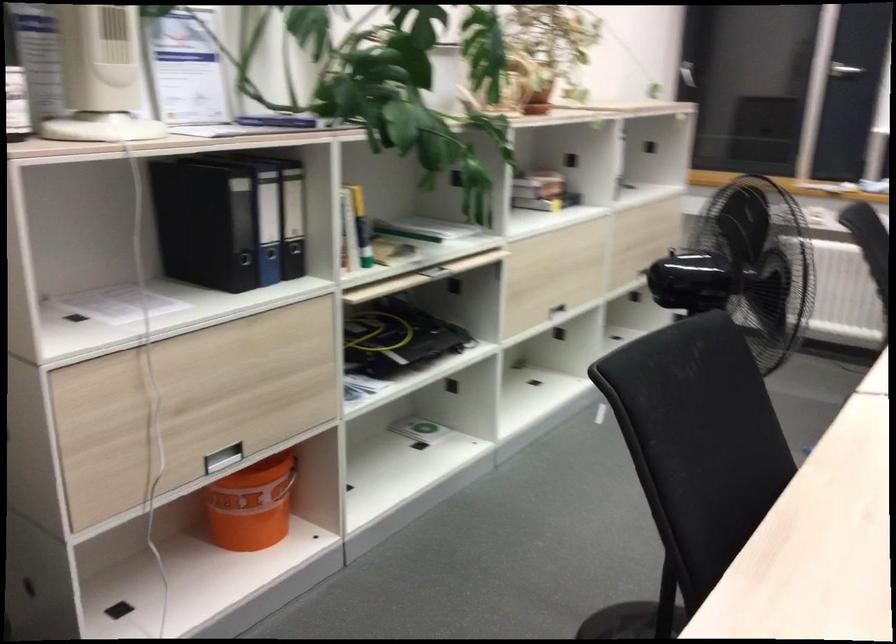
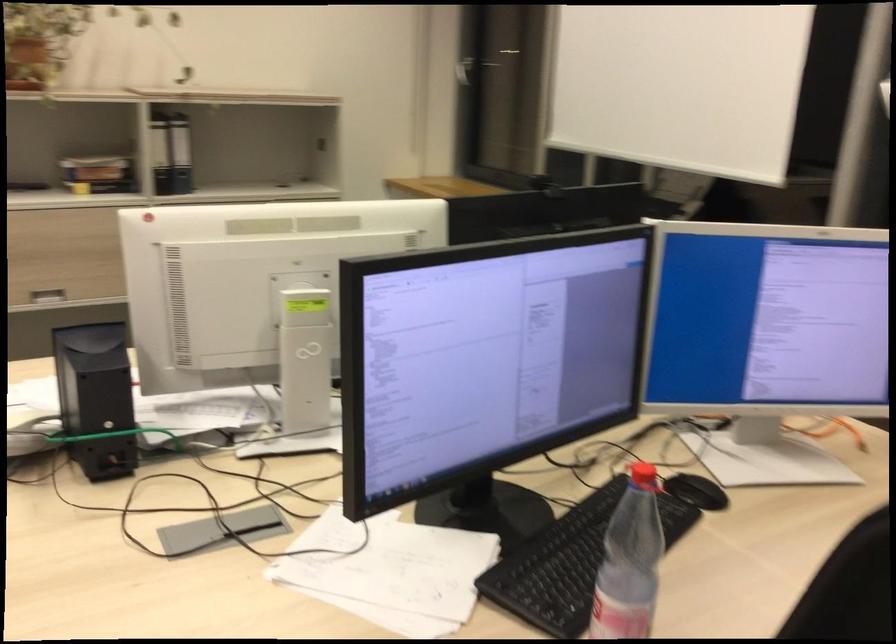
Where in the second image is the point corresponding to point (614, 167) from the first image?

(160, 153)